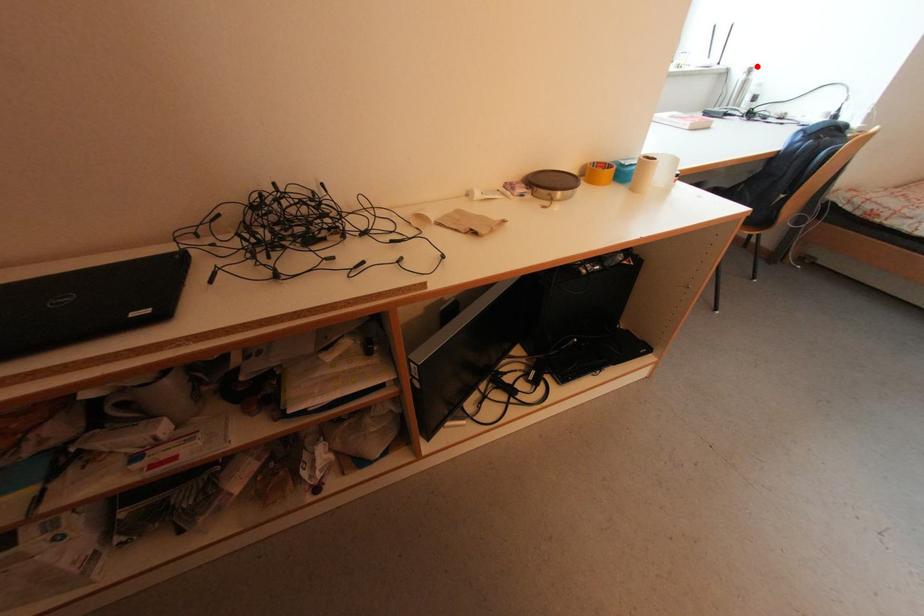
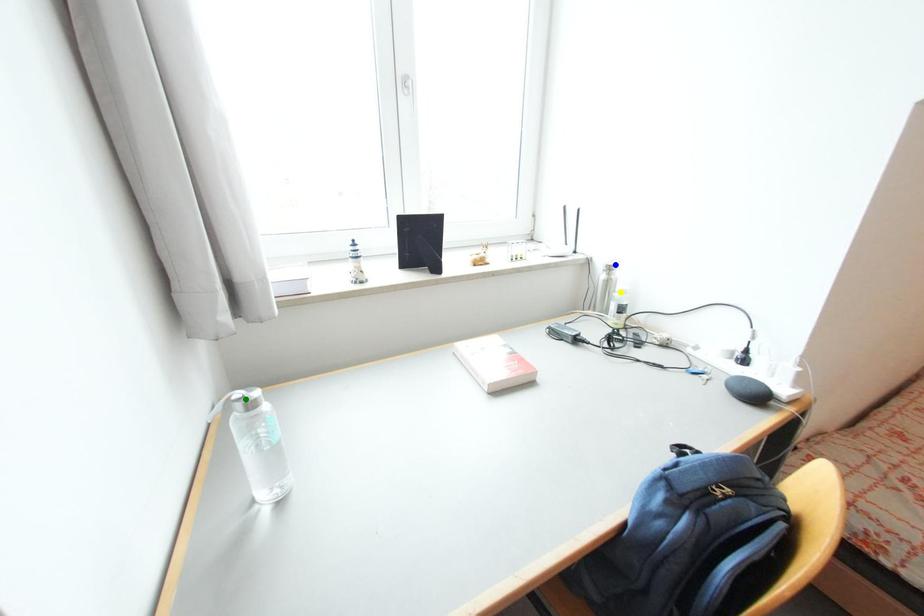
Question: I am providing you with two images of the same scene from different viewpoints. A red point is marked on the first image. You are given multiple points on the second image. Can you choose the point in image 2 that corresponds to the point in image 1?

Choices:
 (A) yellow point
 (B) green point
 (C) blue point

Answer: (C)